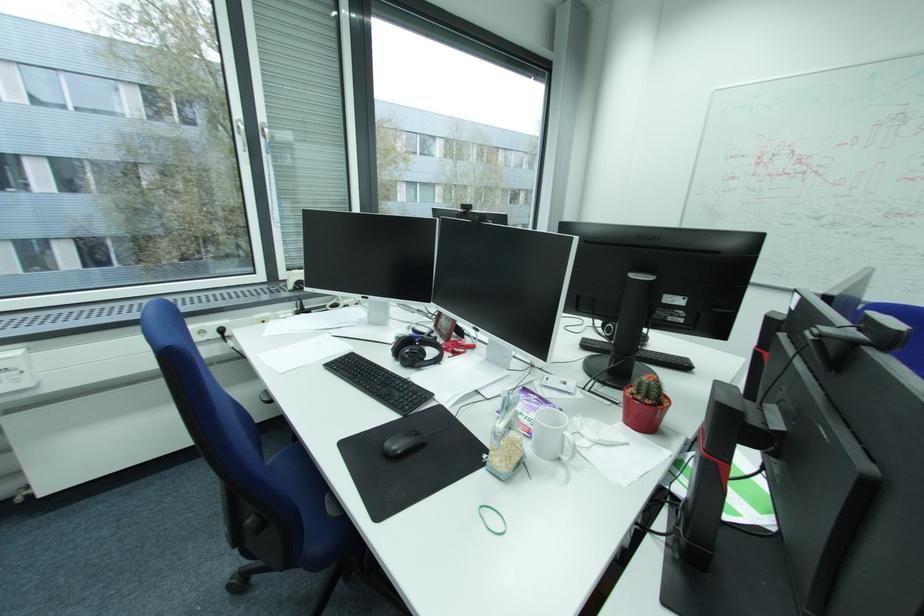
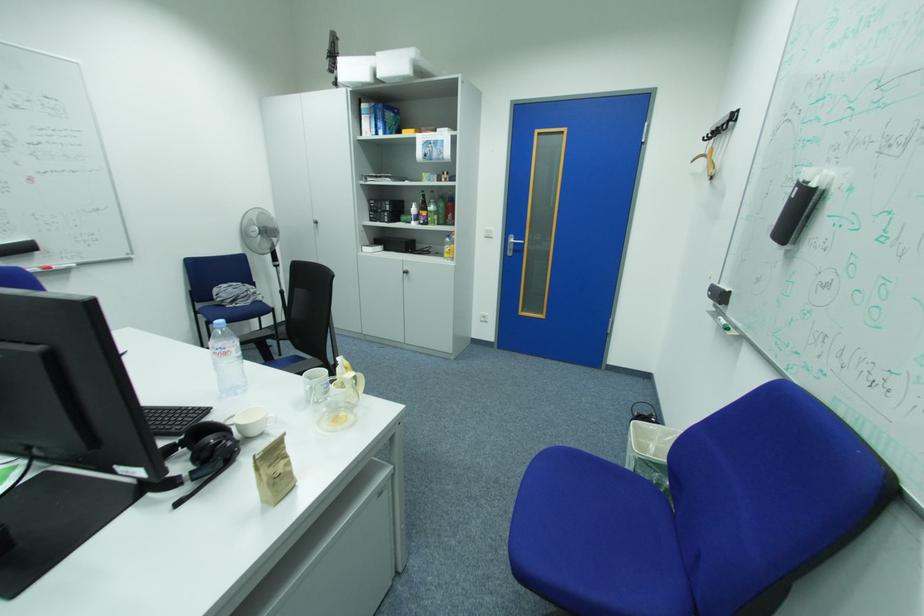
The first image is from the beginning of the video and the second image is from the end. How did the camera likely rotate when shooting the video?

The camera rotated toward right-down.